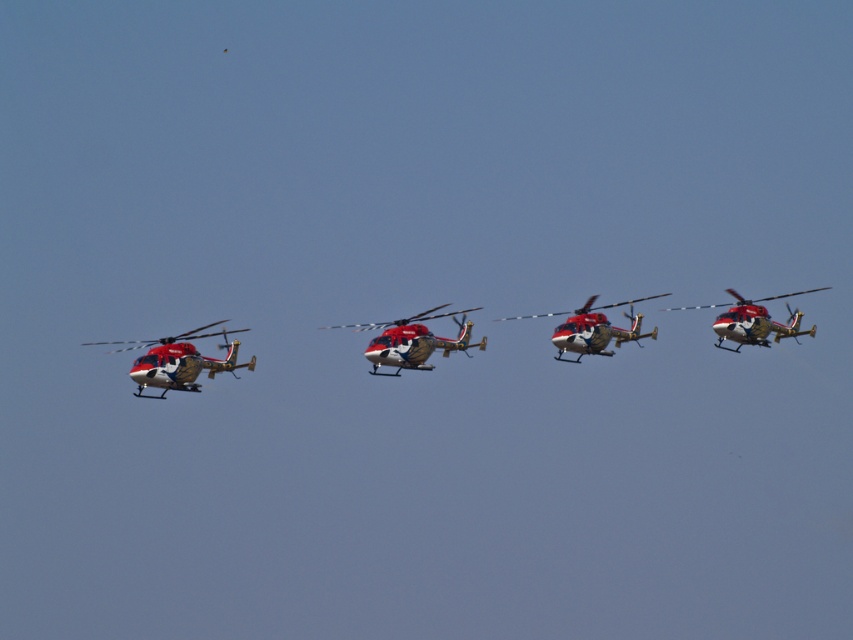
You are a photographer trying to capture a clear shot of both the metallic red helicopter at left and the metallic gold helicopter at right. Since you want both helicopters to appear the same size in your photo, which helicopter should you move closer to?

You should move closer to the metallic gold helicopter at right because its width is smaller than the metallic red helicopter at left. By moving closer to the smaller helicopter, you can make it appear larger in the photo, balancing the sizes of both helicopters.